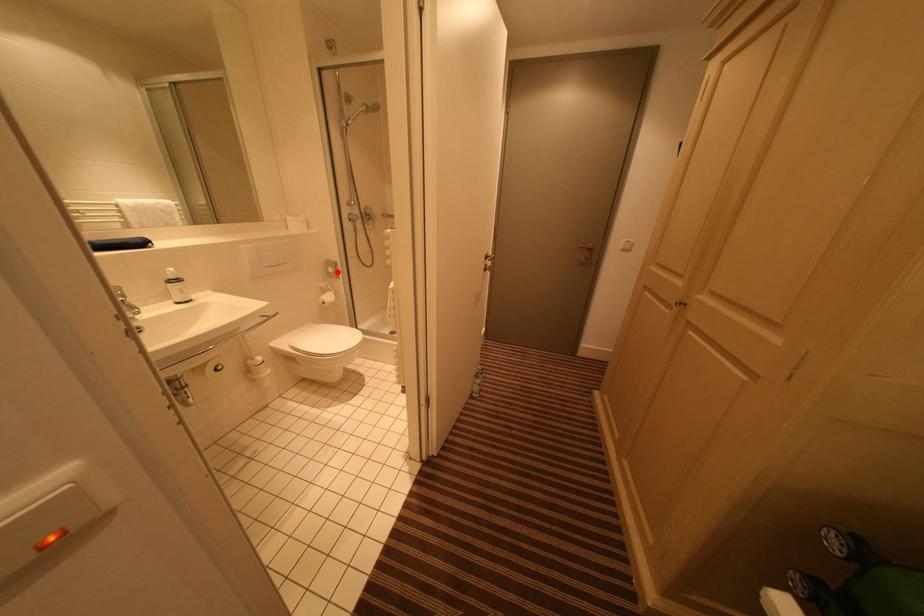
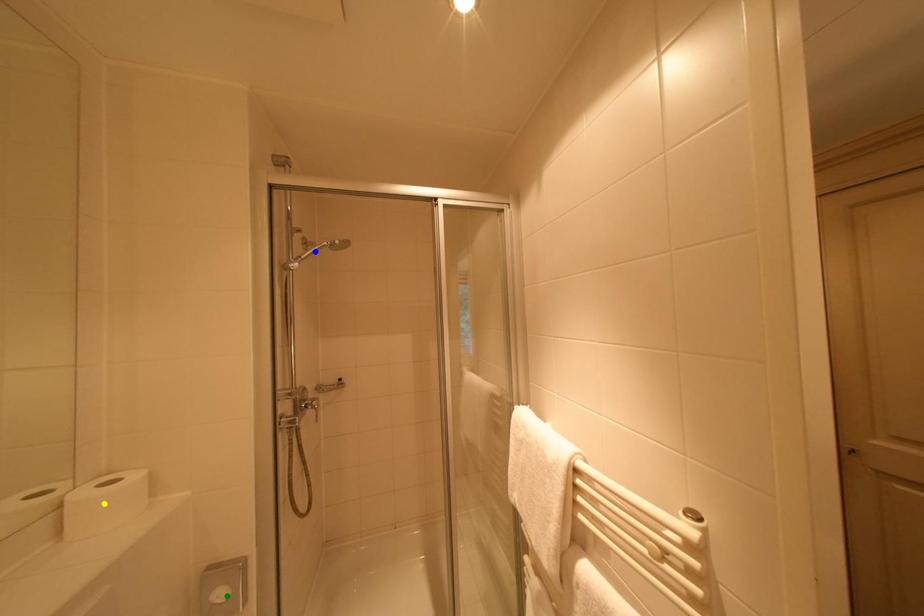
Question: I am providing you with two images of the same scene from different viewpoints. A red point is marked on the first image. You are given multiple points on the second image. Which mark in image 2 goes with the point in image 1?

Choices:
 (A) yellow point
 (B) blue point
 (C) green point

Answer: (C)